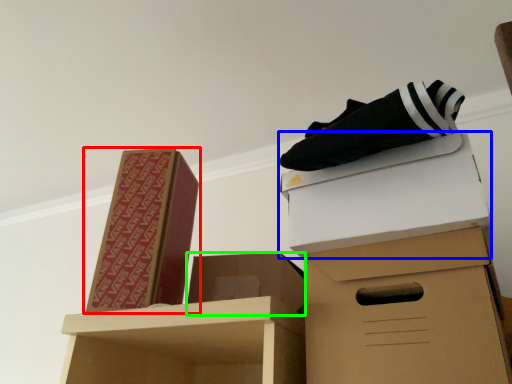
Question: Which object is positioned closest to box (highlighted by a red box)? Select from box (highlighted by a blue box) and box (highlighted by a green box).

Choices:
 (A) box
 (B) box

Answer: (B)